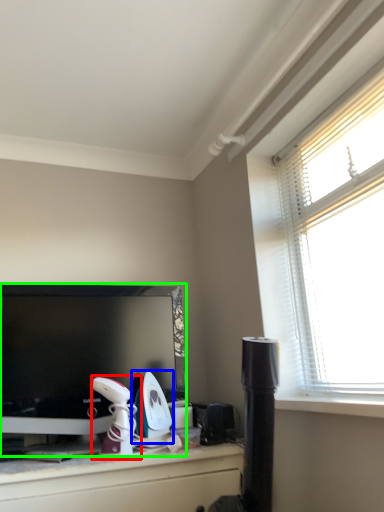
Question: Considering the real-world distances, which object is farthest from appliance (highlighted by a red box)? appliance (highlighted by a blue box) or television (highlighted by a green box)?

Choices:
 (A) appliance
 (B) television

Answer: (B)